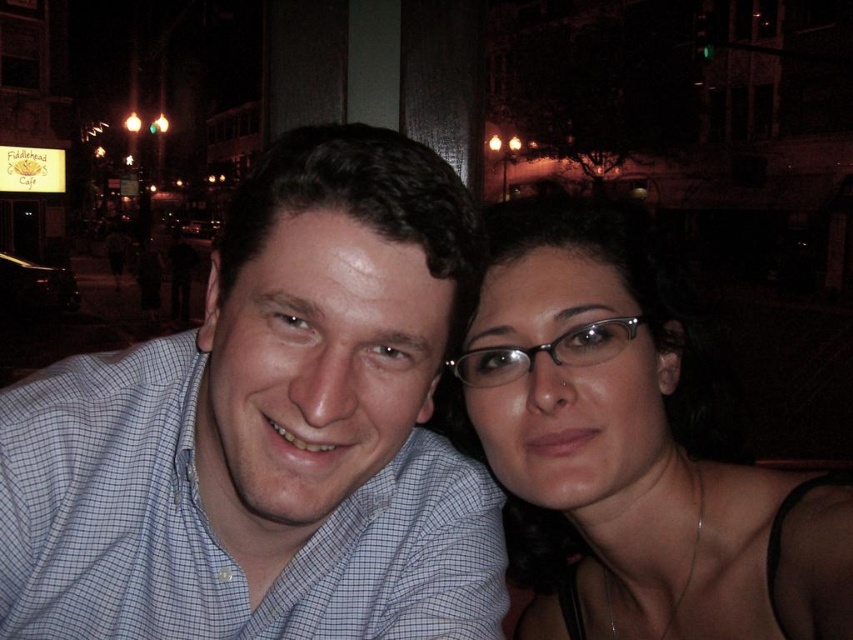
You are a photographer trying to adjust the focus of your camera. You notice two elements in the scene that need to be in focus simultaneously. The blue checkered shirt at center and the matte black hair at right. Which of these two elements should you focus on first to ensure both are in focus, considering their positions?

The blue checkered shirt at center is shorter than the matte black hair at right. To ensure both are in focus, you should focus on the matte black hair at right since it is farther away, allowing the depth of field to cover the closer blue checkered shirt at center.

You are a photographer trying to focus on the blue checkered shirt at center in a nighttime urban scene. The camera can only focus on objects within a radius of 0.1 units from the point specified. Is the blue checkered shirt at center within the focus range of the camera if the focus point is set at point (268, 432)?

The point (268, 432) marks the blue checkered shirt at center, so yes, the blue checkered shirt at center is exactly at the focus point and will be in focus.

You are a photographer trying to focus on the matte black hair at right. What coordinates should you adjust your camera to?

The matte black hair at right is located at coordinates point (631, 449), so adjust your camera to that point.